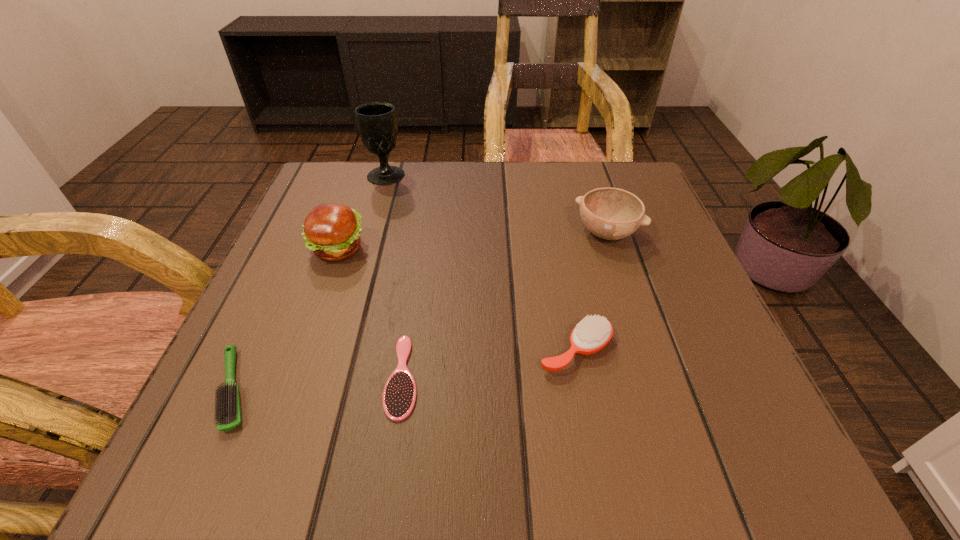
Locate an element on the screen. Image resolution: width=960 pixels, height=540 pixels. hairbrush present at the left edge is located at coordinates (228, 411).

At what (x,y) coordinates should I click in order to perform the action: click on object that is at the right edge. Please return your answer as a coordinate pair (x, y). Looking at the image, I should click on (610, 213).

Where is `object that is at the far left corner`? This screenshot has height=540, width=960. object that is at the far left corner is located at coordinates (376, 121).

What are the coordinates of `object at the near left corner` in the screenshot? It's located at (228, 411).

At what (x,y) coordinates should I click in order to perform the action: click on object that is at the far right corner. Please return your answer as a coordinate pair (x, y). The width and height of the screenshot is (960, 540). Looking at the image, I should click on (610, 213).

This screenshot has width=960, height=540. Find the location of `vacant space at the far edge of the desktop`. vacant space at the far edge of the desktop is located at coordinates (533, 215).

At what (x,y) coordinates should I click in order to perform the action: click on vacant space at the near edge of the desktop. Please return your answer as a coordinate pair (x, y). Looking at the image, I should click on (654, 457).

Find the location of a particular element. vacant space at the left edge of the desktop is located at coordinates (315, 276).

The width and height of the screenshot is (960, 540). Find the location of `vacant area at the right edge`. vacant area at the right edge is located at coordinates (649, 246).

This screenshot has width=960, height=540. In the image, there is a desktop. Identify the location of vacant space at the far left corner. (364, 177).